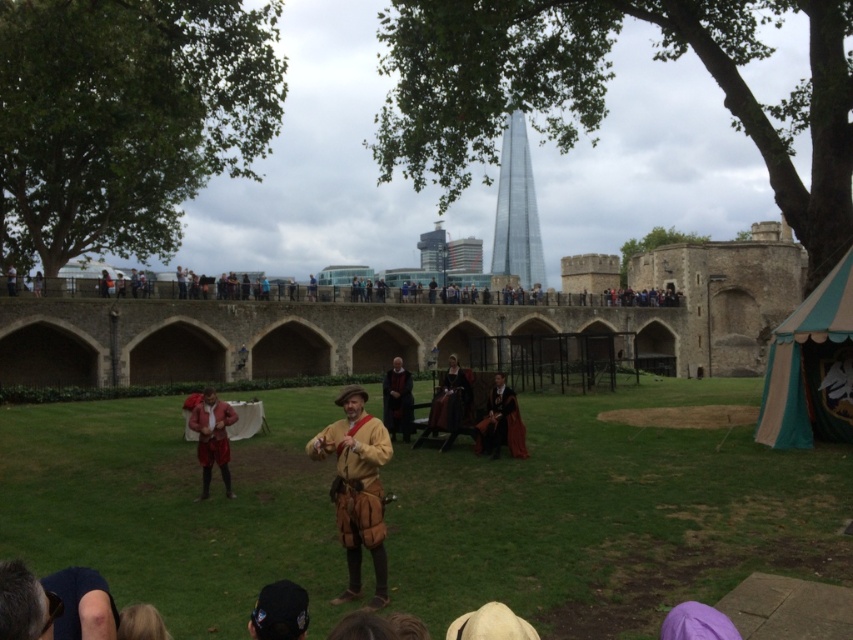
Question: Can you confirm if matte red fabric at center is positioned below velvet black robe at center?

Choices:
 (A) yes
 (B) no

Answer: (A)

Question: Is velvet black robe at center above smooth black robe at center?

Choices:
 (A) no
 (B) yes

Answer: (A)

Question: Among these objects, which one is farthest from the camera?

Choices:
 (A) glassy steel tower at center
 (B) velvet black robe at center
 (C) smooth black robe at center
 (D) velvet red dress at center

Answer: (A)

Question: Which object is farther from the camera taking this photo?

Choices:
 (A) matte red fabric at center
 (B) smooth black robe at center
 (C) glassy steel tower at center
 (D) velvet red dress at center

Answer: (C)

Question: Which point is farther to the camera?

Choices:
 (A) click(401, 429)
 (B) click(502, 401)

Answer: (A)

Question: Is leather brown vest at center closer to the viewer compared to glassy steel tower at center?

Choices:
 (A) yes
 (B) no

Answer: (A)